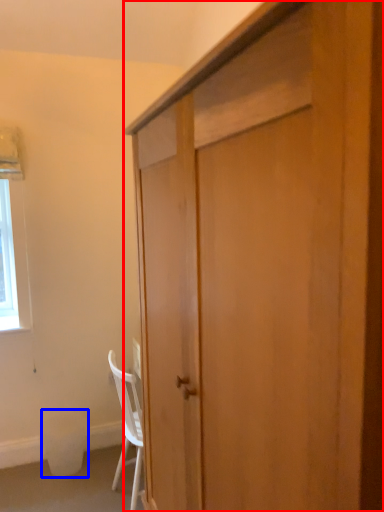
Question: Which object is closer to the camera taking this photo, cabinetry (highlighted by a red box) or trash bin/can (highlighted by a blue box)?

Choices:
 (A) cabinetry
 (B) trash bin/can

Answer: (A)